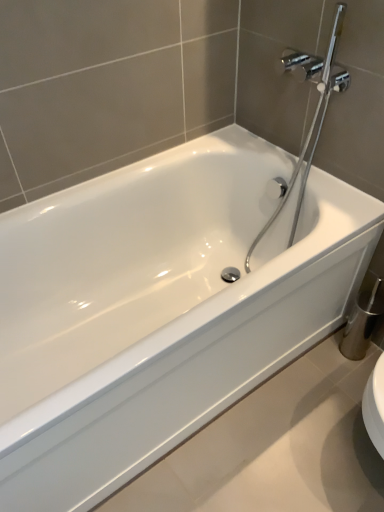
This screenshot has width=384, height=512. What do you see at coordinates (315, 110) in the screenshot? I see `chrome/polished metal showerhead at upper right` at bounding box center [315, 110].

At what (x,y) coordinates should I click in order to perform the action: click on chrome/polished metal showerhead at upper right. Please return your answer as a coordinate pair (x, y). Looking at the image, I should click on (315, 110).

In order to face chrome/polished metal showerhead at upper right, should I rotate leftwards or rightwards?

It's best to rotate right around 11.445 degrees.

In order to click on chrome/polished metal showerhead at upper right in this screenshot , I will do `click(315, 110)`.